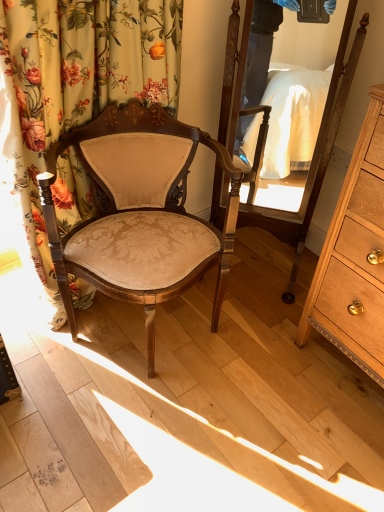
Locate an element on the screen. The height and width of the screenshot is (512, 384). free space in front of matte beige fabric chair at center is located at coordinates (145, 434).